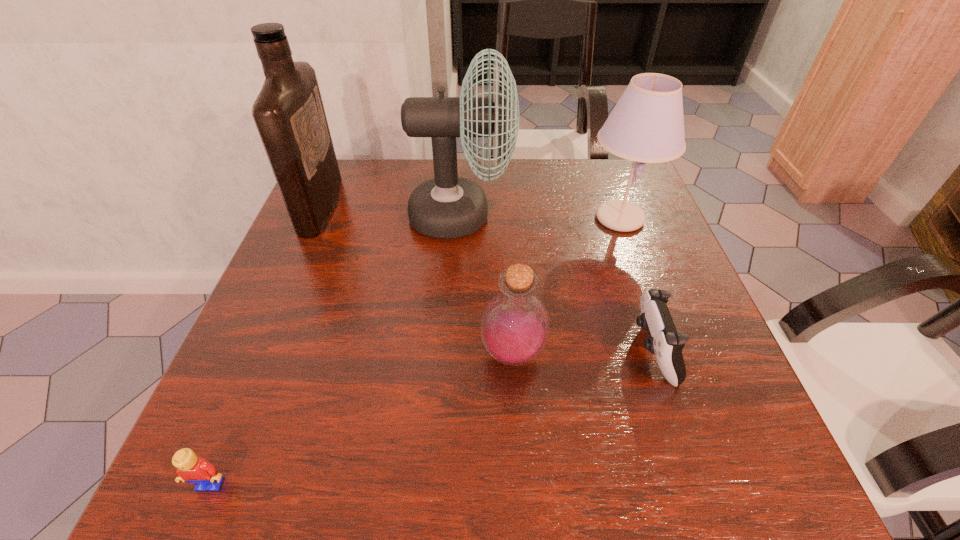
This screenshot has height=540, width=960. Identify the location of control at the right edge. (664, 341).

Where is `object that is positioned at the far left corner`? object that is positioned at the far left corner is located at coordinates (289, 114).

Find the location of a particular element. This screenshot has height=540, width=960. object that is positioned at the near left corner is located at coordinates (189, 468).

Locate an element on the screen. The height and width of the screenshot is (540, 960). object at the far right corner is located at coordinates (647, 124).

This screenshot has height=540, width=960. Identify the location of vacant space at the far edge. point(564,161).

The height and width of the screenshot is (540, 960). I want to click on vacant space at the near edge of the desktop, so click(x=638, y=461).

The width and height of the screenshot is (960, 540). In order to click on free space at the left edge in this screenshot , I will do `click(336, 328)`.

Find the location of a particular element. free space at the right edge of the desktop is located at coordinates [x=658, y=240].

Identify the location of vacant area at the far left corner. (366, 195).

In the image, there is a desktop. What are the coordinates of `free space at the far right corner` in the screenshot? It's located at (609, 165).